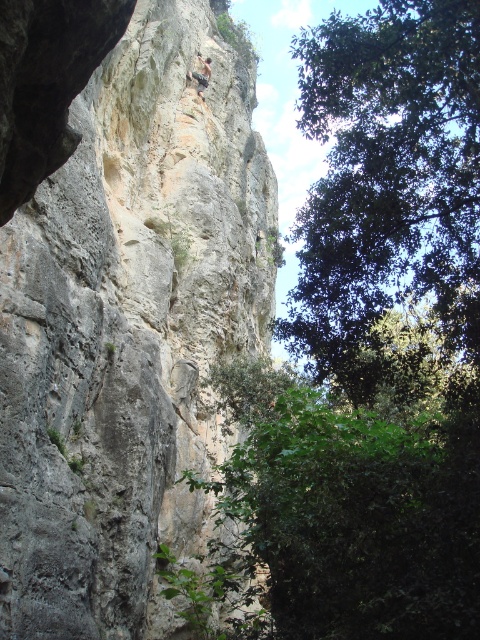
You are a hiker planning to climb the cliff. You see the gray rough rock at center and the green leafy tree at upper right. Which object is higher up on the cliff?

The green leafy tree at upper right is higher up on the cliff because it is positioned above the gray rough rock at center.

You are a geologist analyzing the cliff structure. You notice a point at coordinates (129, 330). What type of rock surface is located at that point?

The point at coordinates (129, 330) indicates gray rough rock at center.

You are a photographer standing at the base of the cliff and want to take a photo of the two points marked in the scene. Which point, point (135, 384) or point (437, 16), will appear closer to the camera in the photo?

Point (135, 384) is further to the camera than point (437, 16), so it will appear closer to the camera in the photo.